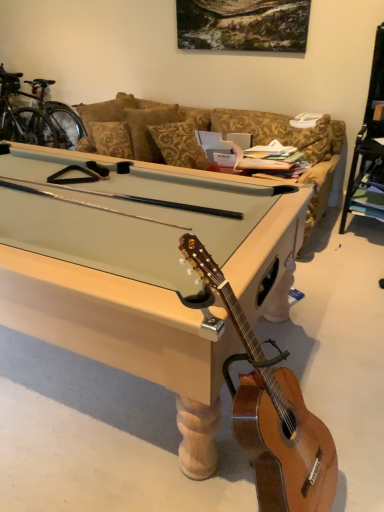
Question: Is light brown wood guitar at lower right taller or shorter than light wood pool table at center?

Choices:
 (A) tall
 (B) short

Answer: (A)

Question: Considering their positions, is light brown wood guitar at lower right located in front of or behind light wood pool table at center?

Choices:
 (A) behind
 (B) front

Answer: (B)

Question: Considering the real-world distances, which object is farthest from the shiny metallic bicycle at upper left?

Choices:
 (A) light brown wood guitar at lower right
 (B) light wood pool table at center

Answer: (A)

Question: Based on their relative distances, which object is farther from the light brown wood guitar at lower right?

Choices:
 (A) light wood pool table at center
 (B) shiny metallic bicycle at upper left

Answer: (B)